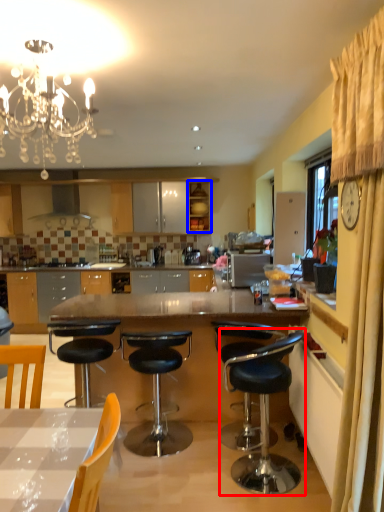
Question: Which object appears farthest to the camera in this image, chair (highlighted by a red box) or cabinetry (highlighted by a blue box)?

Choices:
 (A) chair
 (B) cabinetry

Answer: (B)